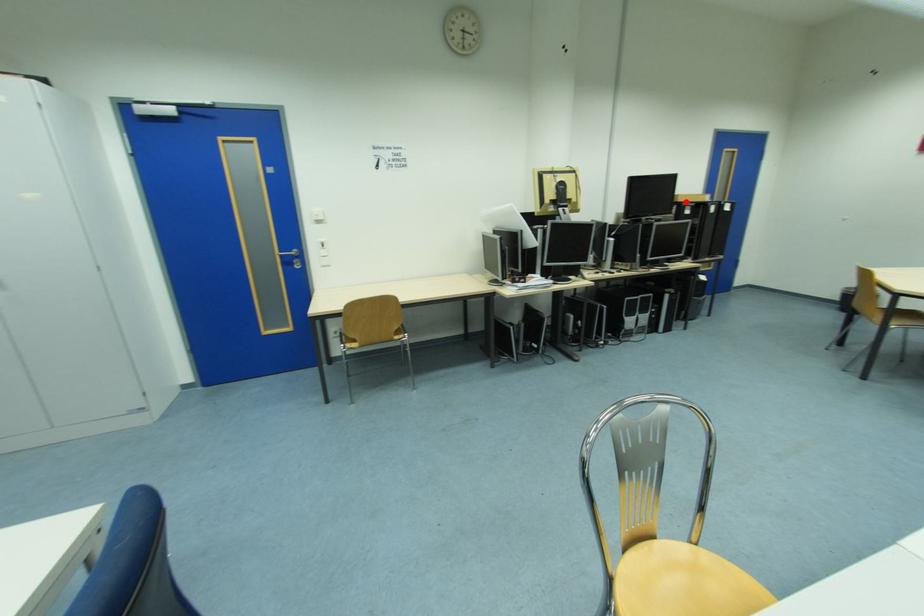
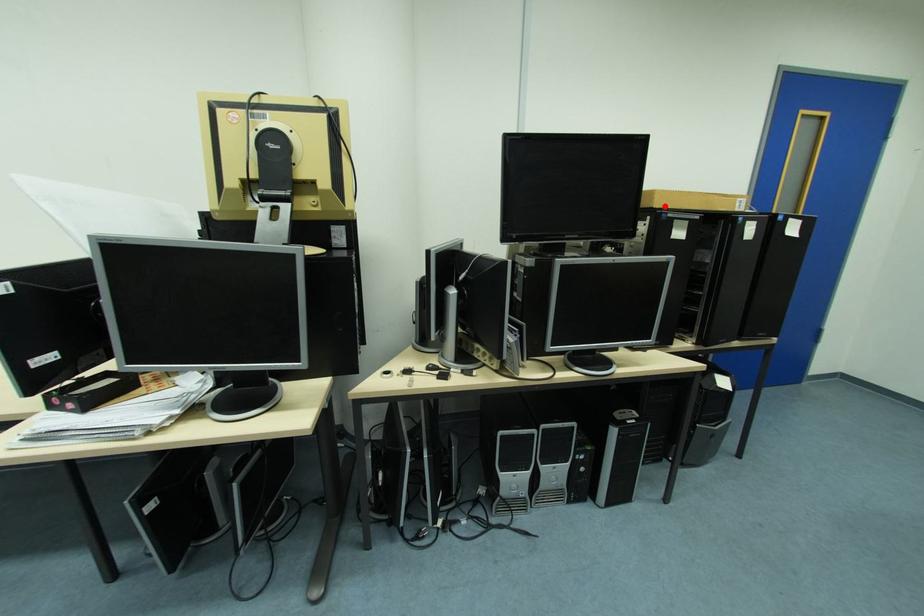
I am providing you with two images of the same scene from different viewpoints. A red point is marked on the first image and another point is marked on the second image. Is the red point in image1 aligned with the point shown in image2?

Yes